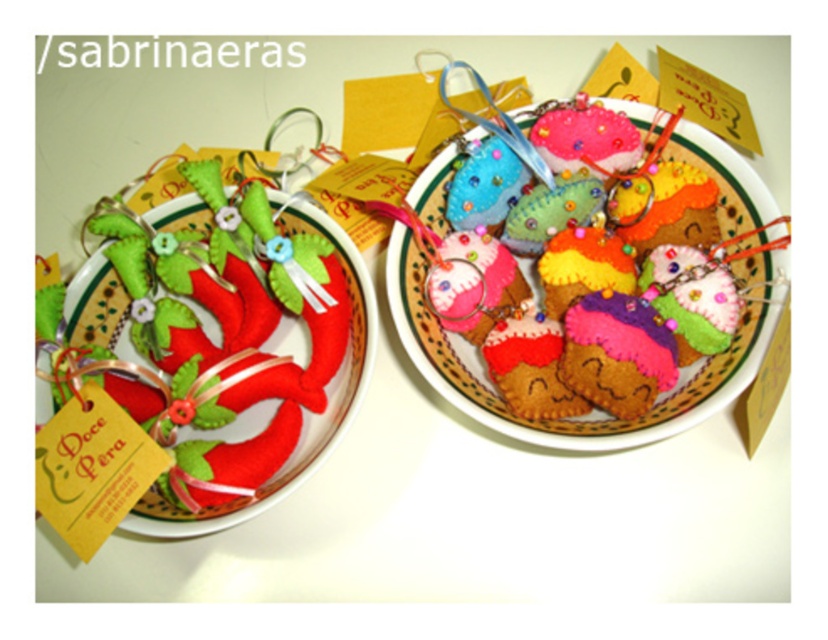
Question: Which of the following is the closest to the observer?

Choices:
 (A) (432, 209)
 (B) (360, 349)

Answer: (B)

Question: Is multicolored felt hearts at center smaller than matte felt paper plate at left?

Choices:
 (A) no
 (B) yes

Answer: (A)

Question: Which of the following is the farthest from the observer?

Choices:
 (A) (310, 204)
 (B) (600, 432)

Answer: (A)

Question: Can you confirm if multicolored felt hearts at center is thinner than matte felt paper plate at left?

Choices:
 (A) no
 (B) yes

Answer: (A)

Question: Can you confirm if multicolored felt hearts at center is smaller than matte felt paper plate at left?

Choices:
 (A) yes
 (B) no

Answer: (B)